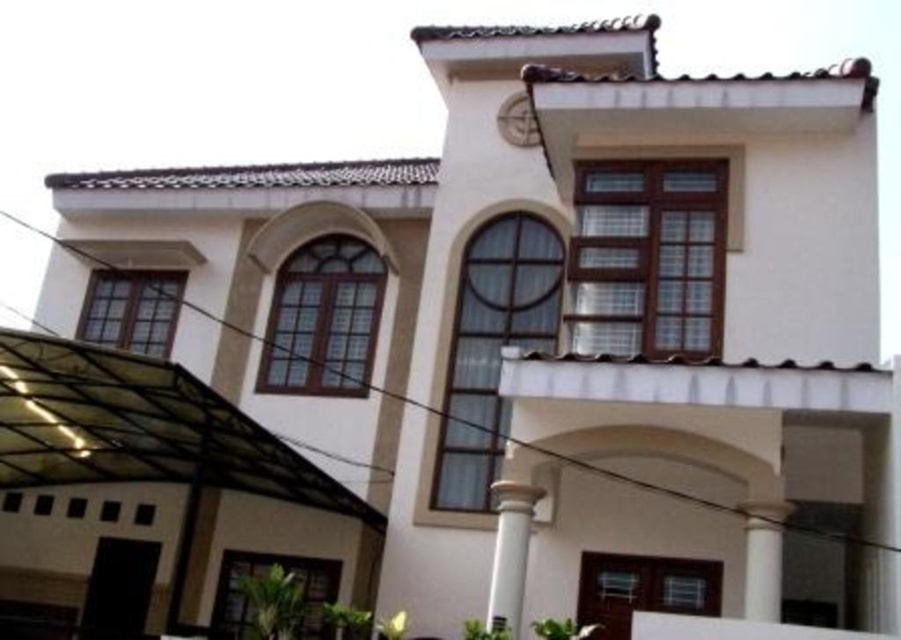
Looking at this image, you are standing in front of the two story residential building and want to know the spatial relationship between the white glossy column at center and the matte white clock at upper center. Which one is located to the left of the other?

The white glossy column at center is positioned on the left side of matte white clock at upper center.